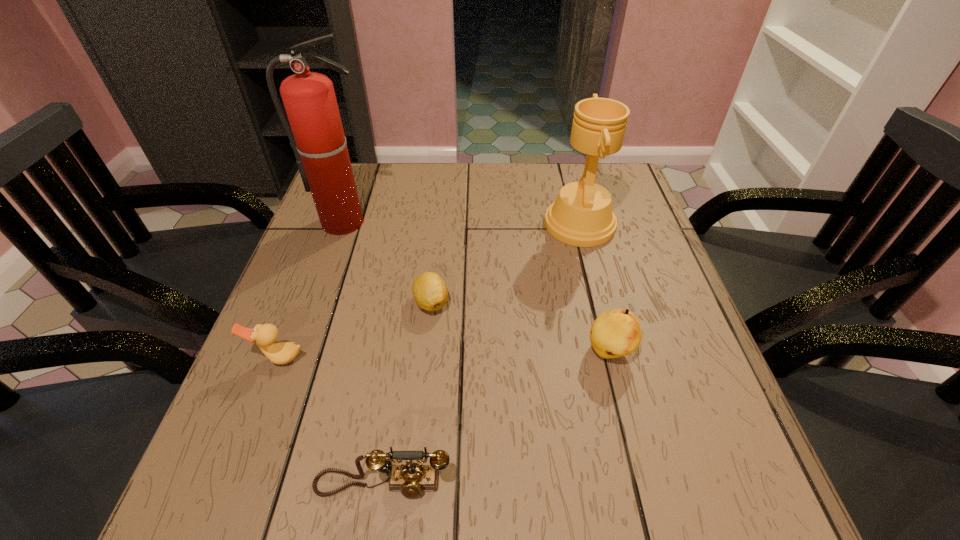
In the image, there is a desktop. Where is `vacant space at the near edge`? Image resolution: width=960 pixels, height=540 pixels. vacant space at the near edge is located at coordinates (535, 477).

Identify the location of vacant space at the left edge of the desktop. (270, 390).

The height and width of the screenshot is (540, 960). What are the coordinates of `vacant area at the right edge` in the screenshot? It's located at (675, 414).

The width and height of the screenshot is (960, 540). What are the coordinates of `vacant region at the near left corner of the desktop` in the screenshot? It's located at (248, 492).

Where is `free region at the far right corner of the desktop`? Image resolution: width=960 pixels, height=540 pixels. free region at the far right corner of the desktop is located at coordinates (610, 182).

Identify the location of vacant space that's between the shortest object and the duck. (355, 330).

You are a GUI agent. You are given a task and a screenshot of the screen. Output one action in this format:
    pyautogui.click(x=<x>, y=<y>)
    Task: Click on the free spot between the duck and the fourth nearest object
    Image resolution: width=960 pixels, height=540 pixels.
    Given the screenshot: What is the action you would take?
    355,330

Identify the location of blank region between the fire extinguisher and the nearest object. (364, 353).

Identify the location of vacant space in between the shortest object and the telephone. (407, 393).

You are a GUI agent. You are given a task and a screenshot of the screen. Output one action in this format:
    pyautogui.click(x=<x>, y=<y>)
    Task: Click on the vacant area that lies between the nearest object and the pear
    
    Given the screenshot: What is the action you would take?
    pyautogui.click(x=496, y=418)